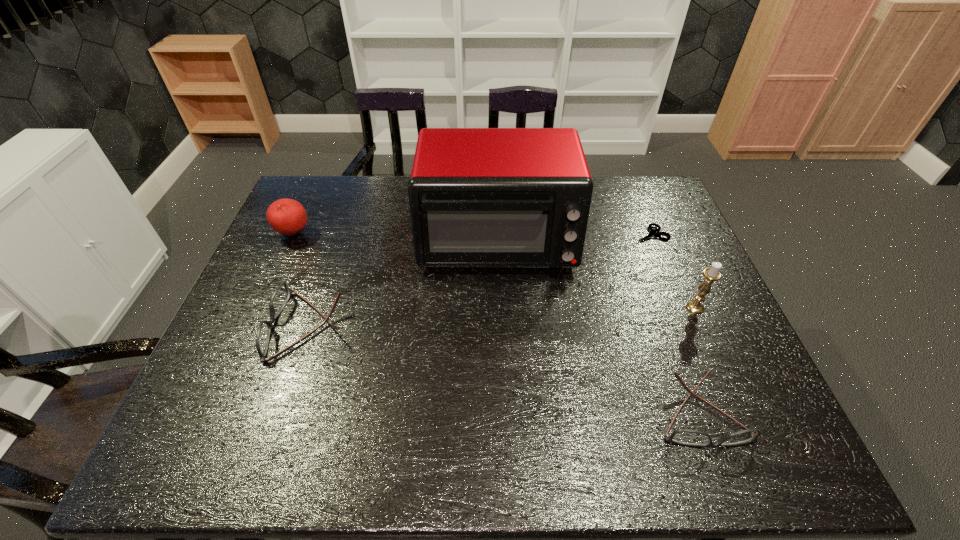
Please point a spot to place another spectacles for symmetrical spacing. Please provide its 2D coordinates. Your answer should be formatted as a tuple, i.e. [(x, y)], where the tuple contains the x and y coordinates of a point satisfying the conditions above.

[(489, 366)]